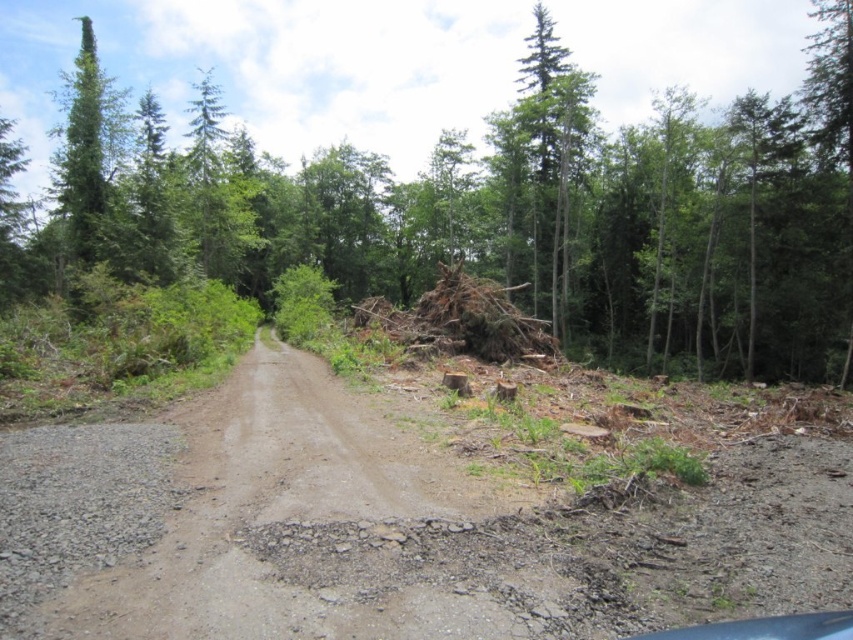
You are driving a delivery truck that is 2.5 meters wide. You need to pass through the area where the brown dirt track at center and the brown wood pile at center are located. Can your truck fit through the space between them?

The brown dirt track at center is positioned on the left side of brown wood pile at center, so the truck can pass through the space between them as long as the width between the track and the wood pile is at least 2.5 meters. However, the exact width isn not specified in the provided information, so it cannot be determined definitively.

You are a hiker carrying a heavy backpack and need to cross the brown dirt track at center. There is a brown wood pile at center nearby. Which object should you step on to avoid getting muddy feet?

The brown wood pile at center is positioned over the brown dirt track at center. To avoid muddy feet, step onto the brown wood pile at center instead of the dirt track.

You are navigating a drone over a rural forest area. Your mission is to drop a package at the exact location of the brown dirt track at center. According to the coordinates provided, where should you direct the drone to drop the package?

The brown dirt track at center is located at coordinates point (x=395, y=524), so you should direct the drone to drop the package there.